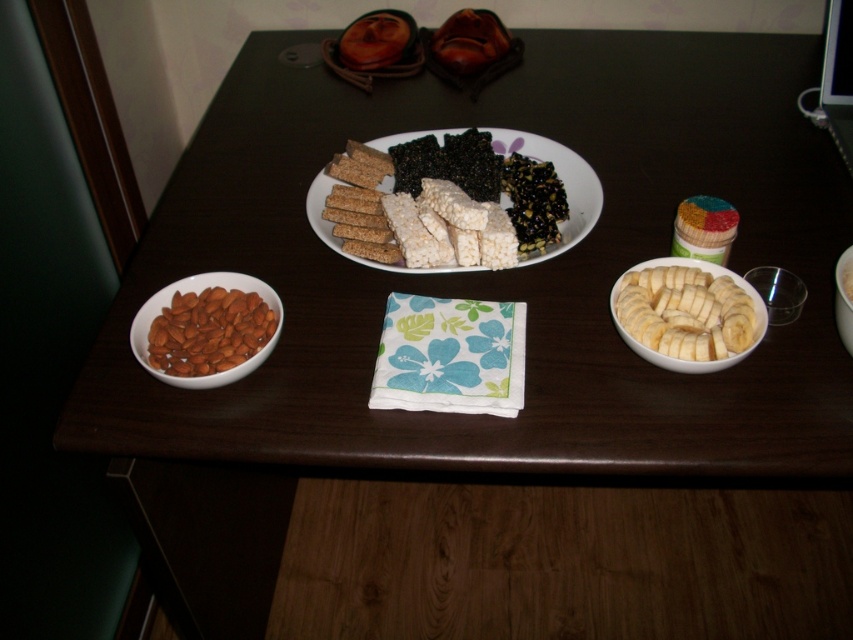
Who is positioned more to the right, smooth almond at left or white ceramic bowl at center?

Positioned to the right is white ceramic bowl at center.

Can you confirm if smooth almond at left is positioned above white ceramic bowl at center?

No.

Is point (244, 324) positioned before point (843, 262)?

Yes, it is in front of point (843, 262).

At what (x,y) coordinates should I click in order to perform the action: click on smooth almond at left. Please return your answer as a coordinate pair (x, y). The image size is (853, 640). Looking at the image, I should click on (209, 332).

Can you confirm if white smooth sliced bananas at right is positioned below white rice cake at center?

Yes, white smooth sliced bananas at right is below white rice cake at center.

Measure the distance from white smooth sliced bananas at right to white rice cake at center.

A distance of 8.28 inches exists between white smooth sliced bananas at right and white rice cake at center.

What do you see at coordinates (685, 312) in the screenshot? This screenshot has height=640, width=853. I see `white smooth sliced bananas at right` at bounding box center [685, 312].

The height and width of the screenshot is (640, 853). I want to click on white smooth sliced bananas at right, so pyautogui.click(x=685, y=312).

Does white smooth sliced bananas at right have a lesser width compared to smooth almond at left?

Yes, white smooth sliced bananas at right is thinner than smooth almond at left.

Is point (616, 314) positioned in front of point (148, 342)?

Yes.

Who is more distant from viewer, (642, 324) or (183, 332)?

The point (183, 332) is behind.

What are the coordinates of `white smooth sliced bananas at right` in the screenshot? It's located at pos(685,312).